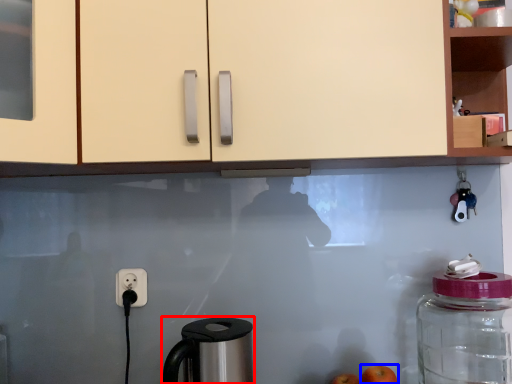
Question: Which point is closer to the camera, coffee maker (highlighted by a red box) or apple (highlighted by a blue box)?

Choices:
 (A) coffee maker
 (B) apple

Answer: (A)